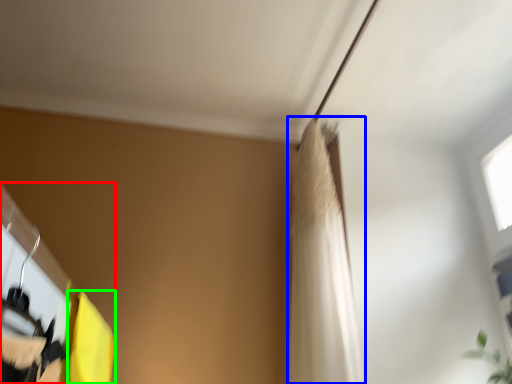
Question: Which is nearer to the closet (highlighted by a red box)? shower curtain (highlighted by a blue box) or curtain (highlighted by a green box).

Choices:
 (A) shower curtain
 (B) curtain

Answer: (B)